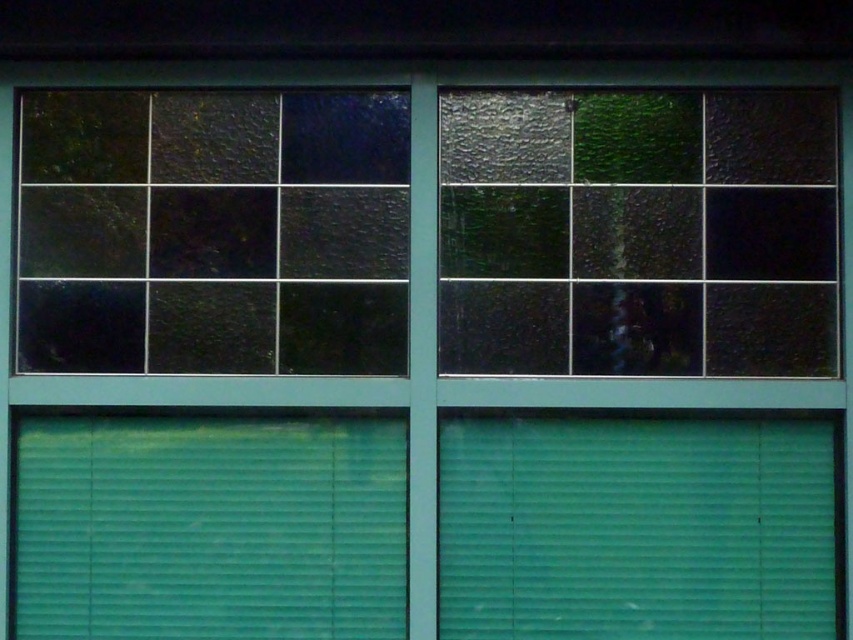
Is textured glass window at center thinner than teal matte shutter at bottom right?

Incorrect, textured glass window at center's width is not less than teal matte shutter at bottom right's.

Image resolution: width=853 pixels, height=640 pixels. I want to click on textured glass window at center, so click(x=637, y=232).

At what (x,y) coordinates should I click in order to perform the action: click on textured glass window at center. Please return your answer as a coordinate pair (x, y). The image size is (853, 640). Looking at the image, I should click on (637, 232).

What do you see at coordinates (213, 230) in the screenshot? The height and width of the screenshot is (640, 853). I see `textured glass window at upper left` at bounding box center [213, 230].

Locate an element on the screen. This screenshot has height=640, width=853. textured glass window at upper left is located at coordinates (213, 230).

Can you confirm if teal matte shutter at bottom right is wider than green matte shutter at lower left?

Incorrect, teal matte shutter at bottom right's width does not surpass green matte shutter at lower left's.

Can you confirm if teal matte shutter at bottom right is positioned to the right of green matte shutter at lower left?

Yes, teal matte shutter at bottom right is to the right of green matte shutter at lower left.

What do you see at coordinates (635, 529) in the screenshot? The image size is (853, 640). I see `teal matte shutter at bottom right` at bounding box center [635, 529].

Identify the location of teal matte shutter at bottom right. This screenshot has height=640, width=853. (635, 529).